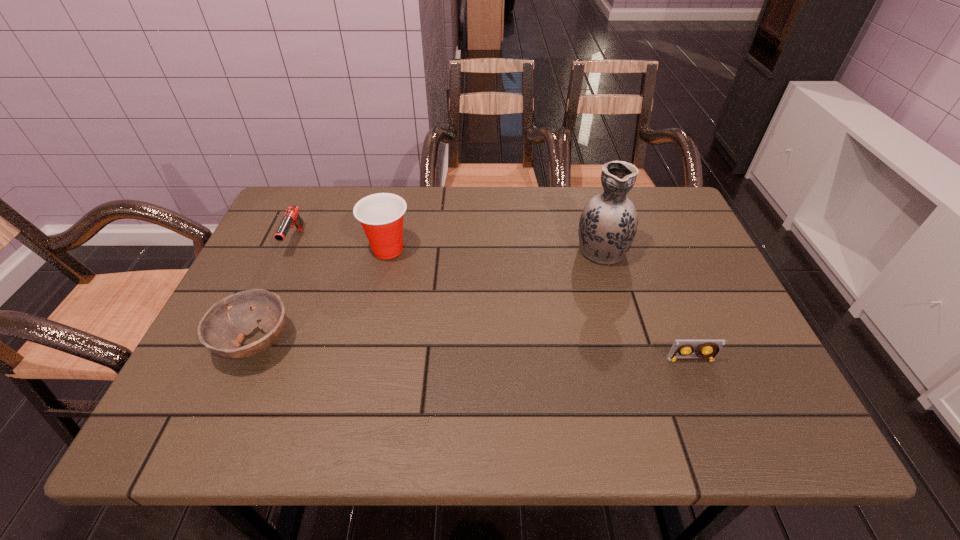
This screenshot has width=960, height=540. What are the coordinates of `vacant space at the far edge of the desktop` in the screenshot? It's located at (491, 204).

The image size is (960, 540). In the image, there is a desktop. In order to click on free space at the near edge in this screenshot , I will do `click(391, 418)`.

Identify the location of vacant space at the left edge. The width and height of the screenshot is (960, 540). (258, 322).

This screenshot has height=540, width=960. I want to click on free point at the right edge, so click(x=732, y=382).

At what (x,y) coordinates should I click in order to perform the action: click on blank space at the far left corner of the desktop. Please return your answer as a coordinate pair (x, y). The height and width of the screenshot is (540, 960). Looking at the image, I should click on (333, 206).

I want to click on free space at the far right corner, so click(640, 222).

Locate an element on the screen. free space between the bowl and the gun is located at coordinates (276, 292).

In order to click on free space between the gun and the bowl in this screenshot , I will do `click(276, 292)`.

What are the coordinates of `free area in between the shortest object and the cup` in the screenshot? It's located at tap(540, 305).

Find the location of `vacant point located between the vase and the third object from right to left`. vacant point located between the vase and the third object from right to left is located at coordinates (494, 249).